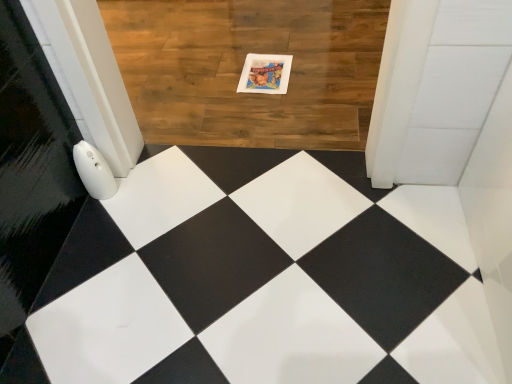
Locate an element on the screen. vacant space underneath matte paper postcard at center (from a real-world perspective) is located at coordinates (264, 72).